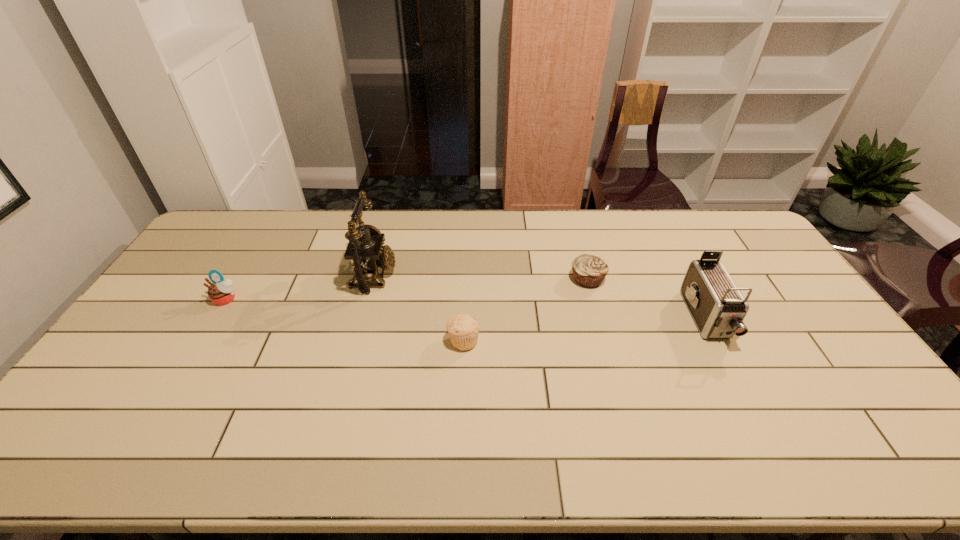
Locate an element on the screen. Image resolution: width=960 pixels, height=540 pixels. blank region between the tallest object and the fourth object from left to right is located at coordinates (480, 277).

Where is `free space between the leftmost muffin and the second object from left to right`? This screenshot has width=960, height=540. free space between the leftmost muffin and the second object from left to right is located at coordinates (300, 287).

Identify the location of free area in between the camcorder and the farthest muffin. This screenshot has width=960, height=540. (646, 299).

Locate an element on the screen. vacant area that lies between the rightmost object and the second nearest muffin is located at coordinates (466, 309).

Image resolution: width=960 pixels, height=540 pixels. In order to click on free spot between the fourth object from right to left and the leftmost object in this screenshot , I will do `click(300, 287)`.

Where is `vacant area that lies between the second farthest muffin and the nearest muffin`? The height and width of the screenshot is (540, 960). vacant area that lies between the second farthest muffin and the nearest muffin is located at coordinates (345, 320).

The height and width of the screenshot is (540, 960). Find the location of `empty space that is in between the second muffin from right to left and the telephone`. empty space that is in between the second muffin from right to left and the telephone is located at coordinates (419, 308).

The image size is (960, 540). I want to click on free point between the telephone and the nearest muffin, so click(419, 308).

I want to click on free space between the third object from left to right and the camcorder, so click(x=585, y=330).

At what (x,y) coordinates should I click in order to perform the action: click on vacant point located between the leftmost muffin and the rightmost muffin. Please return your answer as a coordinate pair (x, y). The width and height of the screenshot is (960, 540). Looking at the image, I should click on (407, 289).